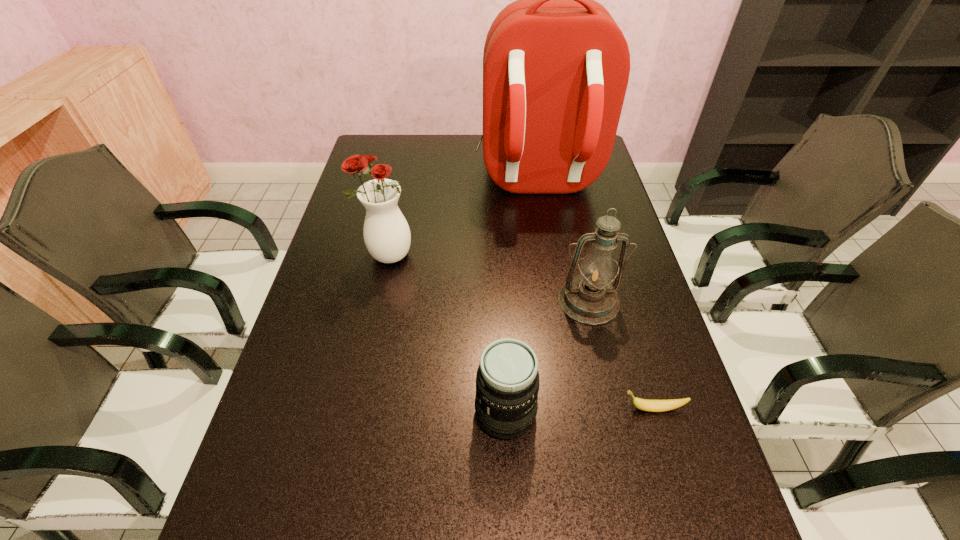
At what (x,y) coordinates should I click in order to perform the action: click on backpack. Please return your answer as a coordinate pair (x, y). The height and width of the screenshot is (540, 960). Looking at the image, I should click on (556, 66).

Where is `the farthest object`? the farthest object is located at coordinates (556, 66).

Locate an element on the screen. The width and height of the screenshot is (960, 540). the fourth nearest object is located at coordinates (386, 232).

Locate an element on the screen. This screenshot has width=960, height=540. the leftmost object is located at coordinates (386, 232).

I want to click on the third nearest object, so click(590, 298).

Where is `telephoto lens`? This screenshot has height=540, width=960. telephoto lens is located at coordinates (507, 382).

Find the location of a particular element. The height and width of the screenshot is (540, 960). banana is located at coordinates (643, 404).

Find the location of a particular element. free space located 0.200m on the strap side of the farthest object is located at coordinates (550, 263).

You are a GUI agent. You are given a task and a screenshot of the screen. Output one action in this format:
    pyautogui.click(x=<x>, y=<y>)
    Task: Click on the free space located on the right of the second farthest object
    The image size is (960, 540).
    Given the screenshot: What is the action you would take?
    pyautogui.click(x=516, y=256)

Identify the location of vacant space located 0.160m on the back of the third farthest object. The height and width of the screenshot is (540, 960). (575, 240).